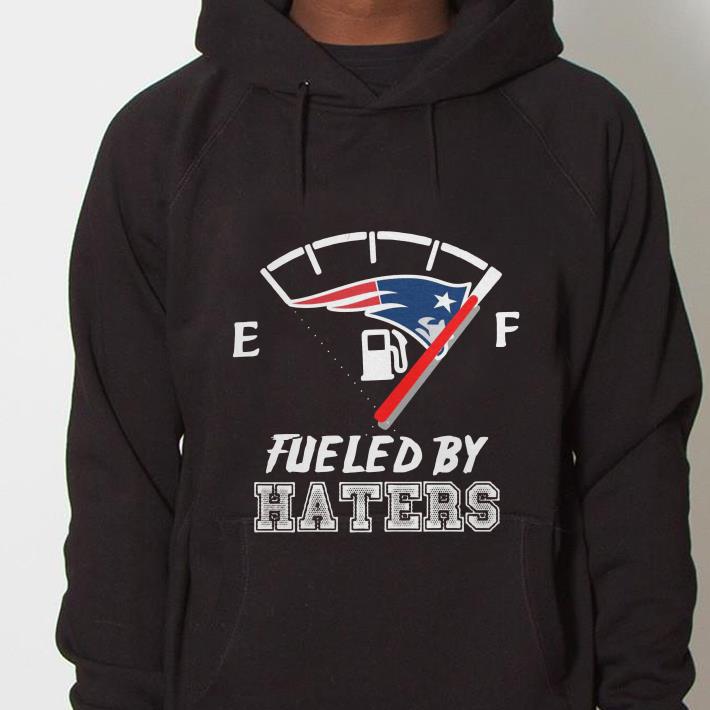
Locate an element on the screen. Image resolution: width=710 pixels, height=710 pixels. white wall is located at coordinates (47, 341).